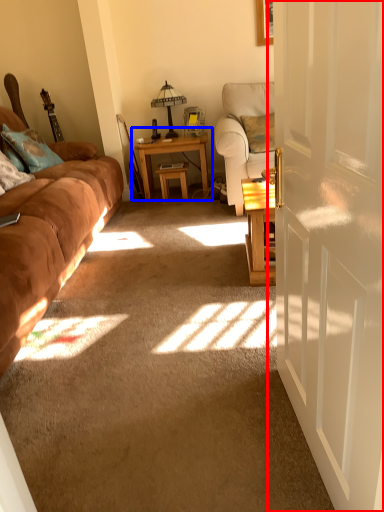
Question: Among these objects, which one is nearest to the camera, door (highlighted by a red box) or table (highlighted by a blue box)?

Choices:
 (A) door
 (B) table

Answer: (A)